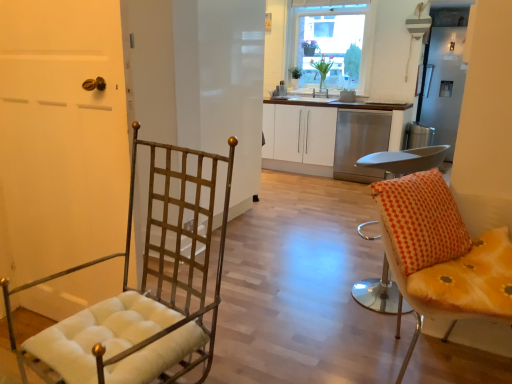
Question: Is clear glass window at upper center facing towards green leafy plant at upper center, the 2th houseplant when ordered from right to left?

Choices:
 (A) no
 (B) yes

Answer: (B)

Question: Is clear glass window at upper center outside of green leafy plant at upper center, the first houseplant positioned from the left?

Choices:
 (A) yes
 (B) no

Answer: (A)

Question: From a real-world perspective, is clear glass window at upper center on green leafy plant at upper center, the first houseplant positioned from the left?

Choices:
 (A) yes
 (B) no

Answer: (A)

Question: Is clear glass window at upper center closer to camera compared to green leafy plant at upper center, the 2th houseplant when ordered from right to left?

Choices:
 (A) no
 (B) yes

Answer: (B)

Question: Considering the relative sizes of clear glass window at upper center and green leafy plant at upper center, the 2th houseplant when ordered from right to left, in the image provided, is clear glass window at upper center bigger than green leafy plant at upper center, the 2th houseplant when ordered from right to left,?

Choices:
 (A) yes
 (B) no

Answer: (A)

Question: Does clear glass window at upper center have a greater height compared to green leafy plant at upper center, the 2th houseplant when ordered from right to left?

Choices:
 (A) no
 (B) yes

Answer: (B)

Question: From a real-world perspective, is white matte cabinet at center physically below metallic grid screen door at center, which appears as the 1th screen door when viewed from the front?

Choices:
 (A) yes
 (B) no

Answer: (A)

Question: Is white matte cabinet at center bigger than metallic grid screen door at center, which appears as the 1th screen door when viewed from the front?

Choices:
 (A) yes
 (B) no

Answer: (B)

Question: Are white matte cabinet at center and metallic grid screen door at center, the 2th screen door in the right-to-left sequence, making contact?

Choices:
 (A) yes
 (B) no

Answer: (B)

Question: From the image's perspective, is white matte cabinet at center above metallic grid screen door at center, which is counted as the second screen door, starting from the back?

Choices:
 (A) yes
 (B) no

Answer: (A)

Question: From a real-world perspective, is white matte cabinet at center located higher than metallic grid screen door at center, the first screen door viewed from the left?

Choices:
 (A) yes
 (B) no

Answer: (B)

Question: Is white matte cabinet at center wider than metallic grid screen door at center, which is counted as the second screen door, starting from the back?

Choices:
 (A) yes
 (B) no

Answer: (A)

Question: Can you confirm if yellow fabric cushion at right, which is the 1th chair in right-to-left order, is positioned to the right of orange fabric cushioned stool at right, marked as the 2th chair in a left-to-right arrangement?

Choices:
 (A) yes
 (B) no

Answer: (A)